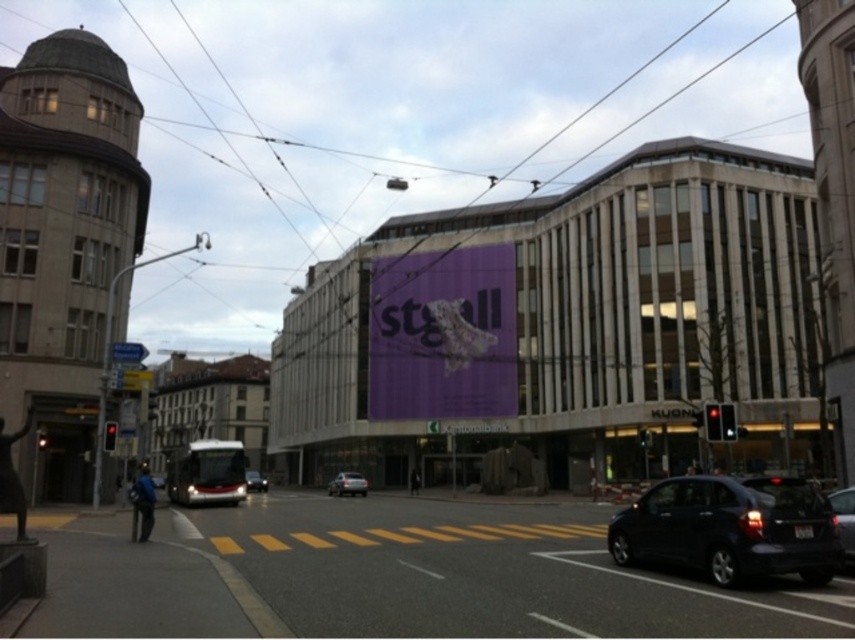
You are a pedestrian wanting to cross the street safely. You see a shiny black car at lower right and a shiny silver bus at center. Which vehicle is closer to the crosswalk?

The shiny black car at lower right is positioned on the right side of the shiny silver bus at center, so the shiny black car at lower right is closer to the crosswalk than the shiny silver bus at center.